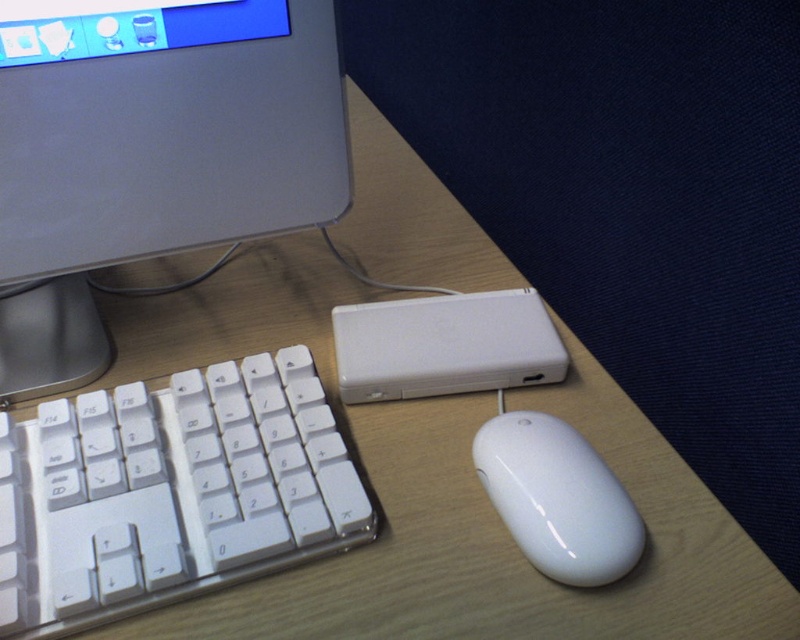
You are a user trying to reach the white glossy mouse at lower right from your current position. Based on the scene description, can you comfortably reach it without moving your chair?

The white glossy mouse at lower right is 16.02 inches away from the viewer. Since this distance is within a typical comfortable reaching distance for most people, you can comfortably reach the white glossy mouse at lower right without moving your chair.

You are setting up a new desk and need to know which monitor is wider. You see a satin silver monitor at upper left and a matte plastic monitor at upper left. Which one has a greater width?

The satin silver monitor at upper left has a greater width than the matte plastic monitor at upper left according to the description.